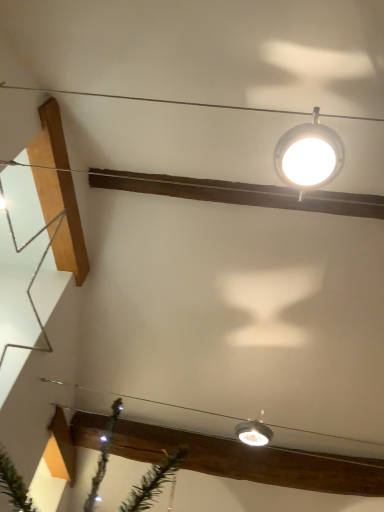
Question: From the image's perspective, is white glossy lamp at upper center, positioned as the 1th lamp in top-to-bottom order, above or below matte silver lamp at lower center, which ranks as the second lamp in front-to-back order?

Choices:
 (A) below
 (B) above

Answer: (B)

Question: Is white glossy lamp at upper center, positioned as the 1th lamp in top-to-bottom order, wider or thinner than matte silver lamp at lower center, which ranks as the second lamp in front-to-back order?

Choices:
 (A) thin
 (B) wide

Answer: (B)

Question: Considering the real-world distances, which object is closest to the metallic silver star at left?

Choices:
 (A) matte silver lamp at lower center, which is the 1th lamp in back-to-front order
 (B) clear plastic wire at lower center
 (C) white glossy lamp at upper center, acting as the 2th lamp starting from the bottom

Answer: (B)

Question: Considering the real-world distances, which object is farthest from the clear plastic wire at lower center?

Choices:
 (A) metallic silver star at left
 (B) white glossy lamp at upper center, acting as the 2th lamp starting from the bottom
 (C) matte silver lamp at lower center, which is the 1th lamp in back-to-front order

Answer: (B)